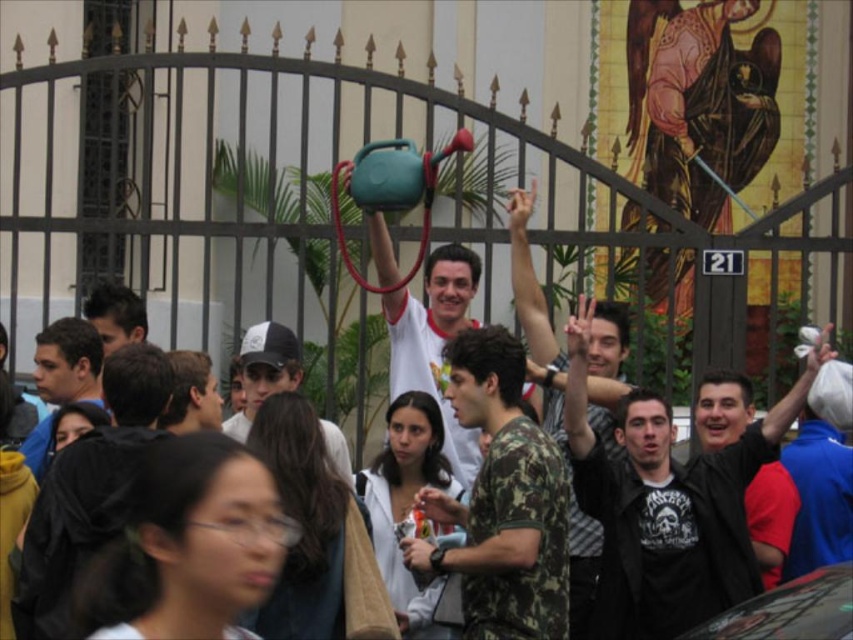
Based on the photo, you are standing in the outdoor scene and want to take a photo of the point at coordinates point (453, 294) and point (59, 321). To ensure both points are in focus, which point should you focus on first?

You should focus on point (59, 321) first because point (453, 294) is behind it, so focusing on the closer point will keep both in focus.

Looking at this image, you are a photographer standing at the center of the scene. You want to take a photo that includes both the matte green water jug at center and the matte black jacket at left. Given that your camera has a maximum zoom range of 15 meters, will you be able to capture both objects in the same frame without moving closer?

The distance between the matte green water jug at center and the matte black jacket at left is 17.83 meters, which exceeds the camera maximum zoom range of 15 meters. Therefore, you cannot capture both objects in the same frame without moving closer.